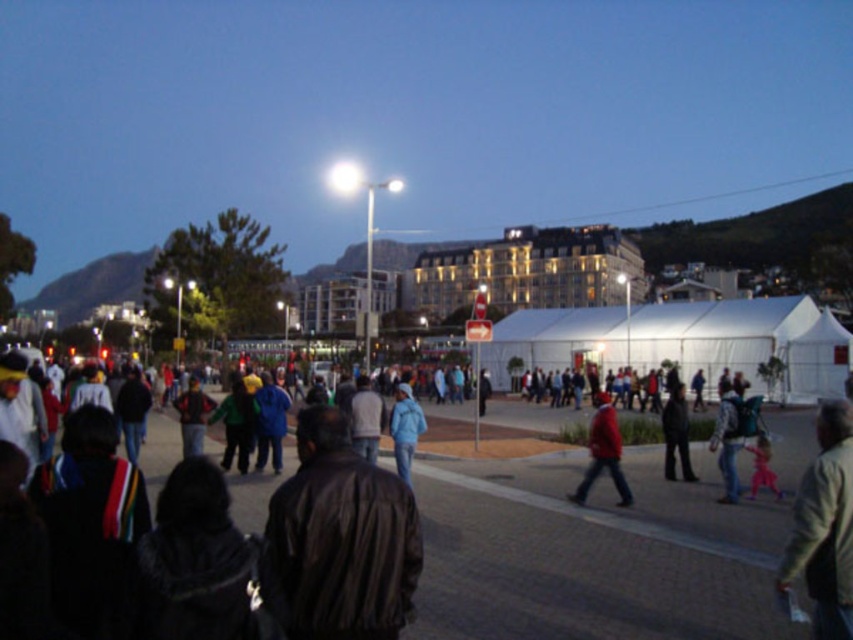
Question: Based on their relative distances, which object is farther from the blue matte jacket at center?

Choices:
 (A) white fabric tent at center
 (B) matte red jacket at center

Answer: (A)

Question: Where is matte red jacket at center located in relation to blue matte jacket at center in the image?

Choices:
 (A) below
 (B) above

Answer: (A)

Question: Can you confirm if white fabric tent at center is positioned above blue matte jacket at center?

Choices:
 (A) yes
 (B) no

Answer: (A)

Question: Which point appears closest to the camera in this image?

Choices:
 (A) (408, 420)
 (B) (552, 358)
 (C) (630, 493)

Answer: (C)

Question: Is white fabric tent at center closer to the viewer compared to blue matte jacket at center?

Choices:
 (A) yes
 (B) no

Answer: (B)

Question: Which point is farther to the camera?

Choices:
 (A) white fabric tent at center
 (B) blue matte jacket at center

Answer: (A)